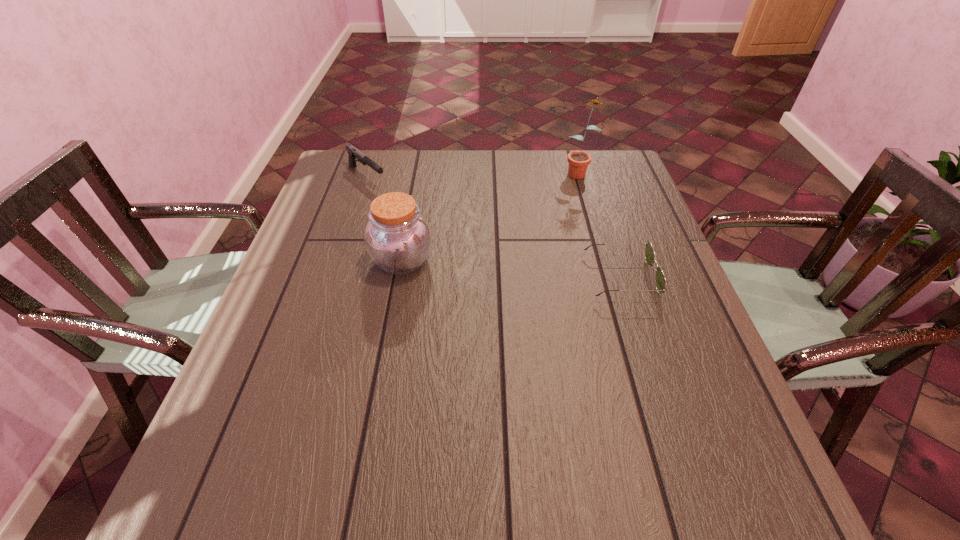
You are a GUI agent. You are given a task and a screenshot of the screen. Output one action in this format:
    pyautogui.click(x=<x>, y=<y>)
    Task: Click on the jar
    
    Given the screenshot: What is the action you would take?
    pyautogui.click(x=397, y=237)

The image size is (960, 540). I want to click on the third shortest object, so click(397, 237).

Locate an element on the screen. The width and height of the screenshot is (960, 540). sunglasses is located at coordinates (660, 281).

Identify the location of sunflower. This screenshot has width=960, height=540. (578, 161).

Locate an element on the screen. This screenshot has height=540, width=960. the third tallest object is located at coordinates (353, 153).

Find the location of a particular element. the leftmost object is located at coordinates (353, 153).

You are a GUI agent. You are given a task and a screenshot of the screen. Output one action in this format:
    pyautogui.click(x=<x>, y=<y>)
    Task: Click on the free space located on the front of the second tallest object
    
    Given the screenshot: What is the action you would take?
    pyautogui.click(x=384, y=360)

You are a GUI agent. You are given a task and a screenshot of the screen. Output one action in this format:
    pyautogui.click(x=<x>, y=<y>)
    Task: Click on the free space located 0.240m on the flower of the tallest object
    This screenshot has width=960, height=540.
    Given the screenshot: What is the action you would take?
    pyautogui.click(x=538, y=221)

You are a GUI agent. You are given a task and a screenshot of the screen. Output one action in this format:
    pyautogui.click(x=<x>, y=<y>)
    Task: Click on the vacant space positioned on the flower of the tallest object
    The width and height of the screenshot is (960, 540).
    Given the screenshot: What is the action you would take?
    pyautogui.click(x=527, y=233)

Image resolution: width=960 pixels, height=540 pixels. I want to click on vacant position located 0.300m on the flower of the tallest object, so click(527, 233).